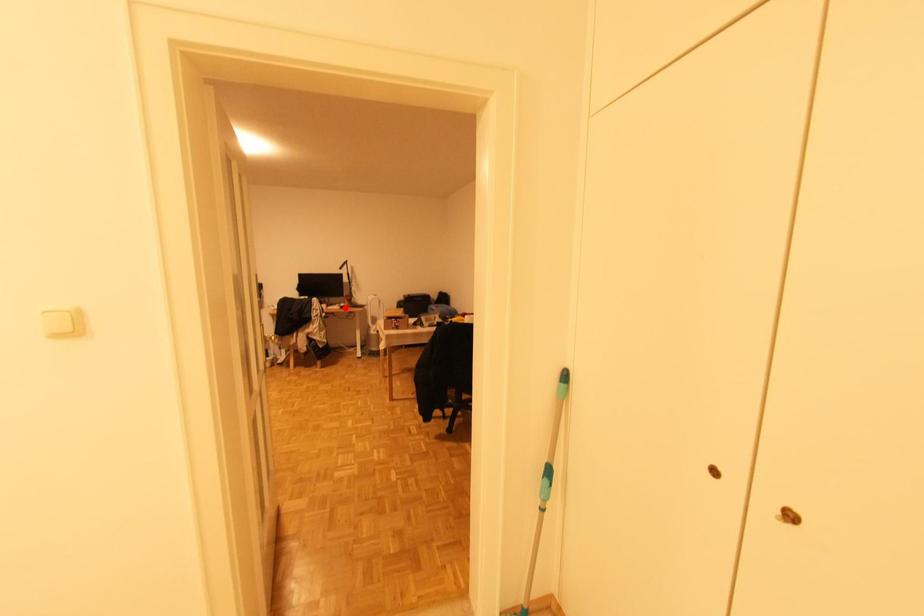
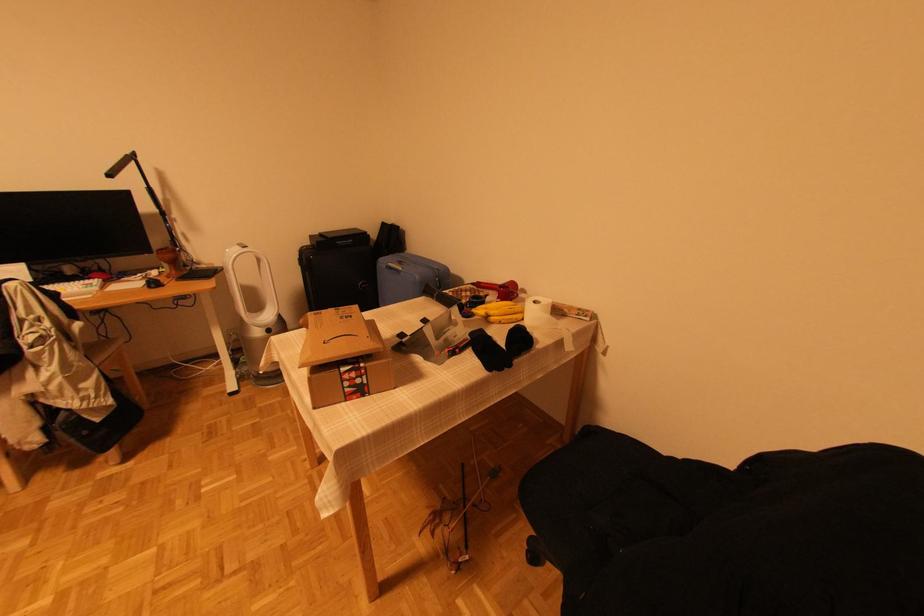
In the second image, find the point that corresponds to the highlighted location in the first image.

(156, 284)